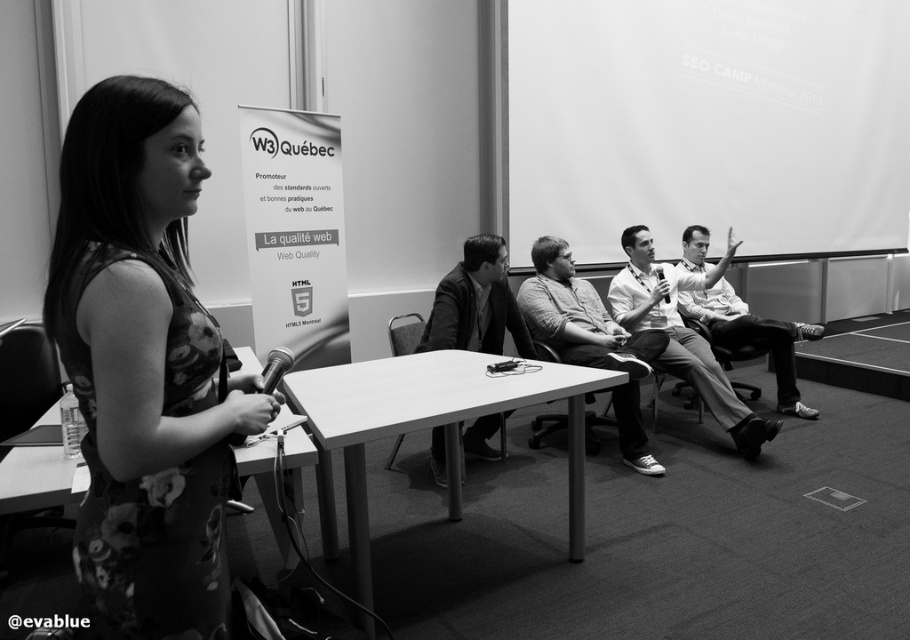
From the picture: You are organizing a presentation and need to place a name tag on the table. The name tag is the same size as the metallic silver microphone at center. Will the smooth leather jacket at center block the placement of the name tag?

The smooth leather jacket at center is larger in size than the metallic silver microphone at center. Since the name tag is the same size as the microphone, the jacket may block the placement if it occupies more space on the table.